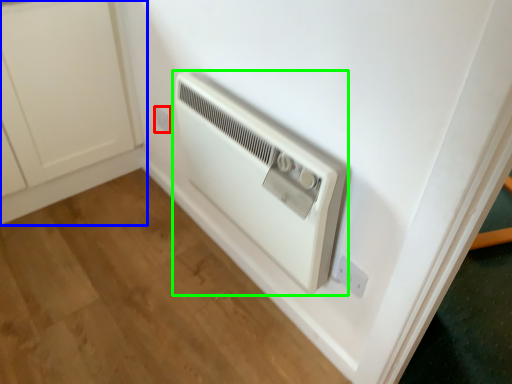
Question: Which is farther away from electric outlet (highlighted by a red box)? cabinetry (highlighted by a blue box) or home appliance (highlighted by a green box)?

Choices:
 (A) cabinetry
 (B) home appliance

Answer: (B)